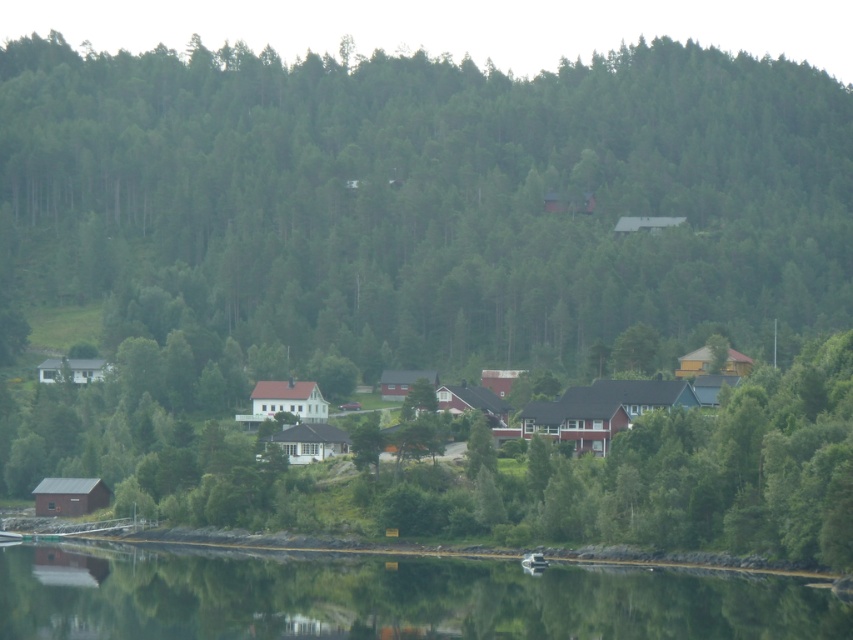
Question: Can you confirm if green matte tree at center is positioned to the left of transparent water at lower center?

Choices:
 (A) yes
 (B) no

Answer: (B)

Question: Which object appears closest to the camera in this image?

Choices:
 (A) white matte house at center
 (B) green matte tree at center

Answer: (A)

Question: Among these objects, which one is nearest to the camera?

Choices:
 (A) green matte tree at center
 (B) transparent water at lower center

Answer: (B)

Question: Based on their relative distances, which object is farther from the transparent water at lower center?

Choices:
 (A) green matte tree at center
 (B) white matte house at center

Answer: (A)

Question: Can you confirm if transparent water at lower center is positioned to the right of white matte house at center?

Choices:
 (A) no
 (B) yes

Answer: (A)

Question: Considering the relative positions of green matte tree at center and white matte house at center in the image provided, where is green matte tree at center located with respect to white matte house at center?

Choices:
 (A) below
 (B) above

Answer: (B)